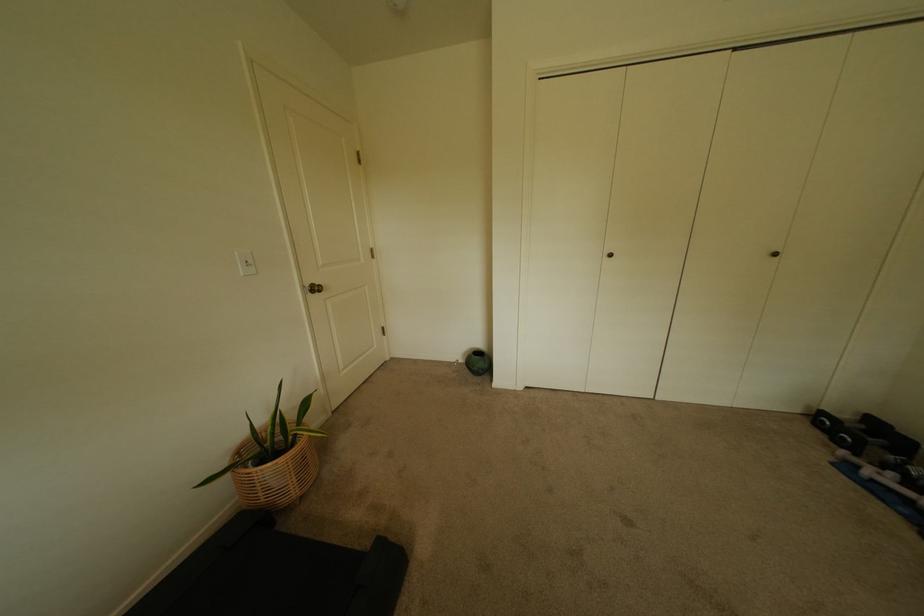
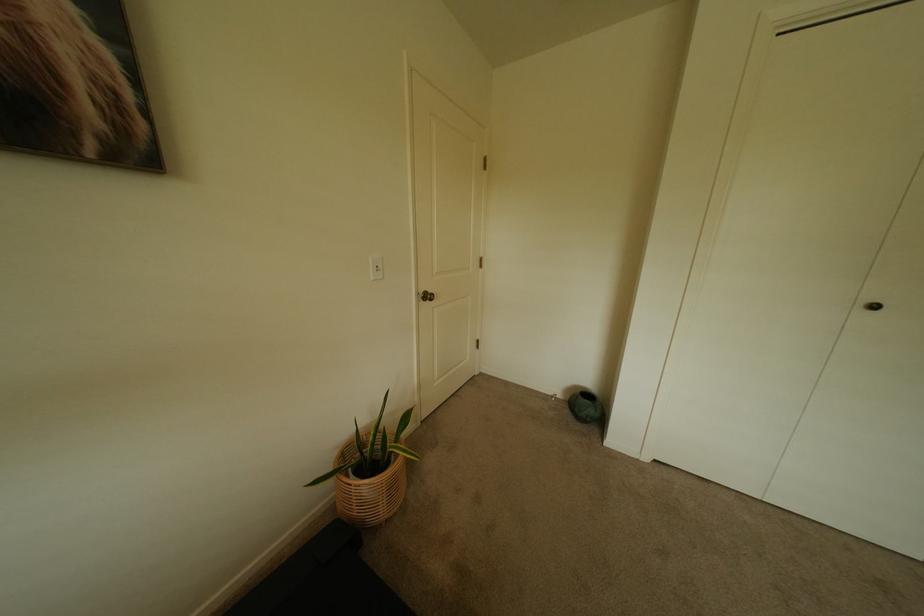
Consider the image. What movement of the cameraman would produce the second image?

The cameraman walked toward left, forward.